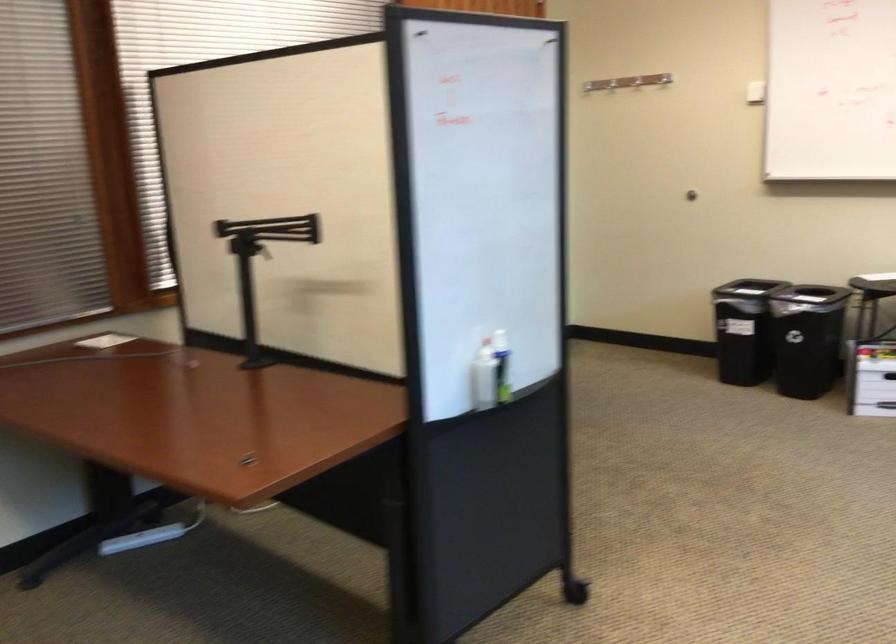
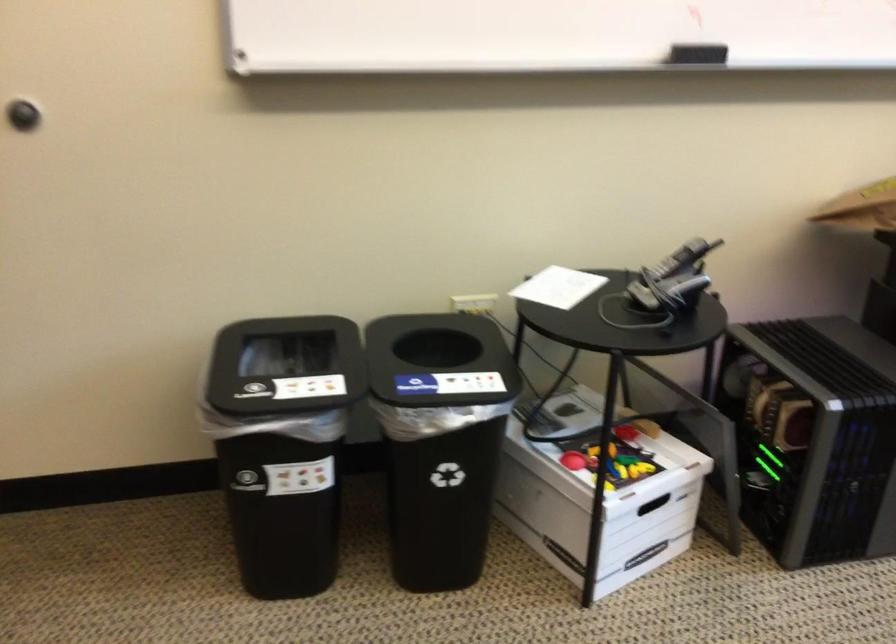
Locate, in the second image, the point that corresponds to pixel 702 287 in the first image.

(286, 366)